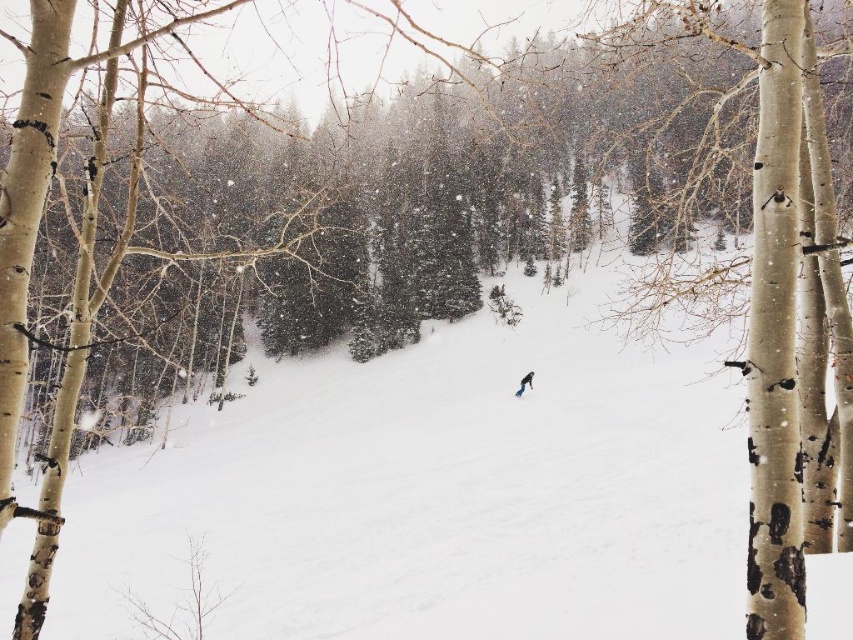
You are a photographer trying to capture the blue matte snowboard at center and the blue metallic ski at center in a single shot. Given that your camera has a fixed focus on the center, which object will appear bigger in the photo?

The blue matte snowboard at center will appear bigger in the photo because it is larger in size than the blue metallic ski at center.